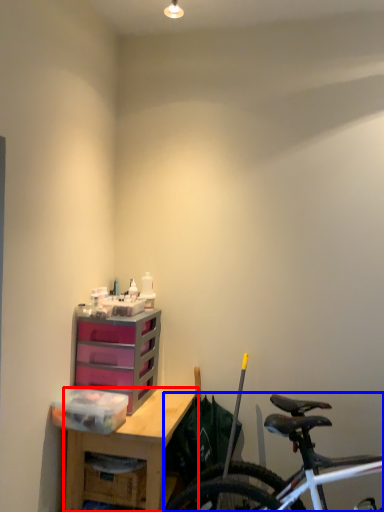
Question: Which object appears closest to the camera in this image, desk (highlighted by a red box) or bicycle (highlighted by a blue box)?

Choices:
 (A) desk
 (B) bicycle

Answer: (B)